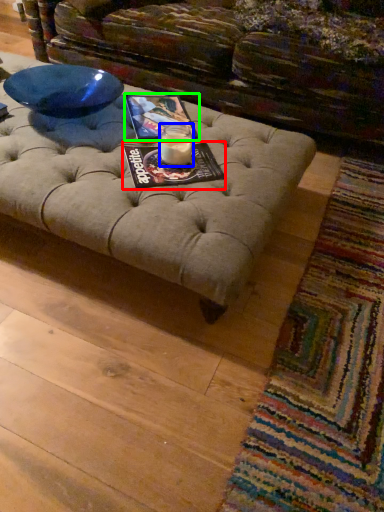
Question: Estimate the real-world distances between objects in this image. Which object is closer to magazine (highlighted by a red box), candle holder (highlighted by a blue box) or magazine (highlighted by a green box)?

Choices:
 (A) candle holder
 (B) magazine

Answer: (A)